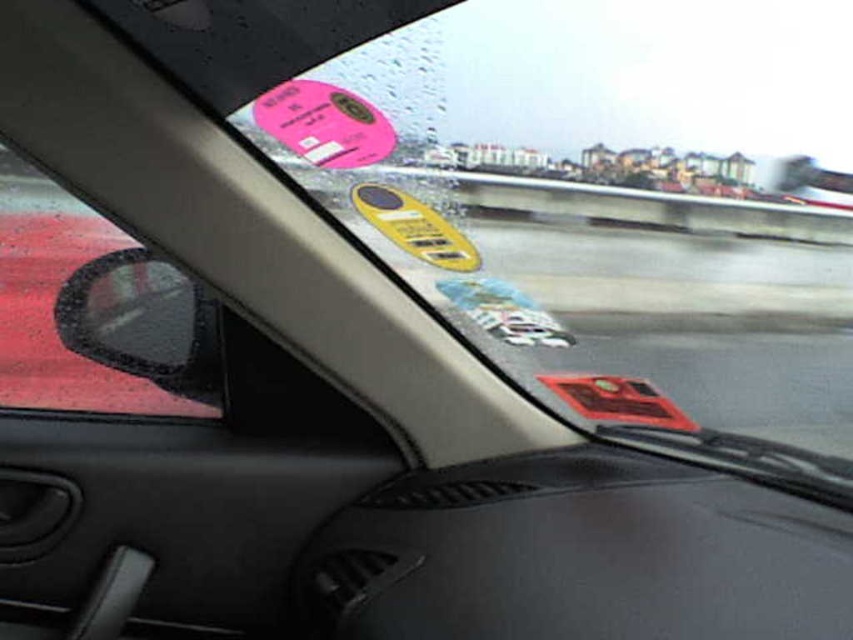
Can you confirm if transparent rubber side mirror at left is smaller than red matte sticker at center?

Yes.

Is transparent rubber side mirror at left taller than red matte sticker at center?

Yes, transparent rubber side mirror at left is taller than red matte sticker at center.

Is point (85, 404) positioned behind point (595, 417)?

No, (85, 404) is in front of (595, 417).

Where is `transparent rubber side mirror at left`? transparent rubber side mirror at left is located at coordinates (57, 301).

Measure the distance from pink glossy sticker at upper center to red matte sticker at center.

pink glossy sticker at upper center is 3.92 feet away from red matte sticker at center.

Based on the photo, is pink glossy sticker at upper center positioned in front of red matte sticker at center?

Yes, it is.

In order to click on pink glossy sticker at upper center in this screenshot , I will do `click(323, 124)`.

Where is `pink glossy sticker at upper center`? The height and width of the screenshot is (640, 853). pink glossy sticker at upper center is located at coordinates tap(323, 124).

Between transparent rubber side mirror at left and yellow matte keychain at center, which one is positioned lower?

transparent rubber side mirror at left is below.

From the picture: Is transparent rubber side mirror at left to the left of yellow matte keychain at center from the viewer's perspective?

Yes, transparent rubber side mirror at left is to the left of yellow matte keychain at center.

Describe the element at coordinates (57, 301) in the screenshot. The width and height of the screenshot is (853, 640). I see `transparent rubber side mirror at left` at that location.

I want to click on transparent rubber side mirror at left, so click(x=57, y=301).